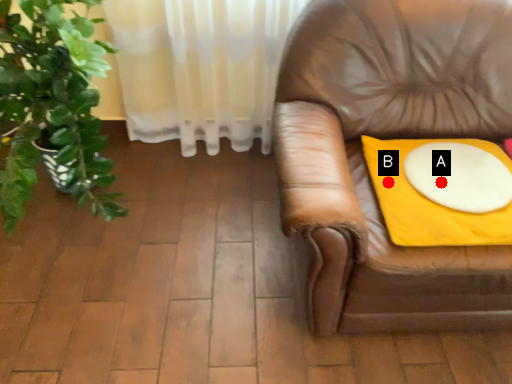
Question: Two points are circled on the image, labeled by A and B beside each circle. Which point is farther to the camera?

Choices:
 (A) A is further
 (B) B is further

Answer: (B)